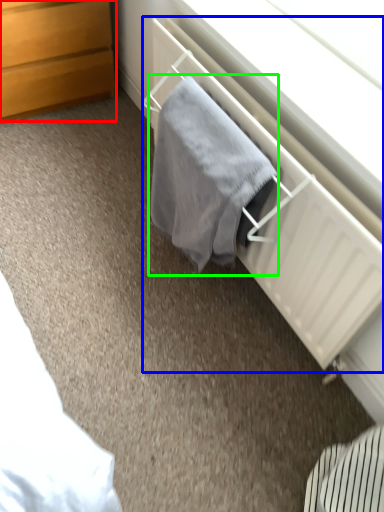
Question: Based on their relative distances, which object is nearer to chest of drawers (highlighted by a red box)? Choose from radiator (highlighted by a blue box) and bath towel (highlighted by a green box).

Choices:
 (A) radiator
 (B) bath towel

Answer: (A)